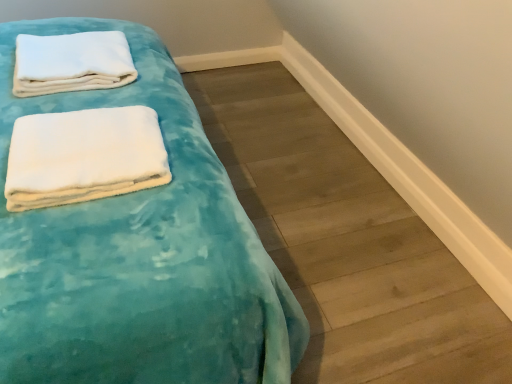
This screenshot has height=384, width=512. Find the location of `white soft towel at upper left, the second towel when ordered from back to front`. white soft towel at upper left, the second towel when ordered from back to front is located at coordinates (84, 156).

Identify the location of white soft towel at upper left, the 1th towel in the front-to-back sequence. This screenshot has width=512, height=384. (84, 156).

Based on their sizes in the image, would you say white soft towel at upper left, positioned as the first towel in bottom-to-top order, is bigger or smaller than white soft towel at upper left, positioned as the 1th towel in back-to-front order?

Clearly, white soft towel at upper left, positioned as the first towel in bottom-to-top order, is smaller in size than white soft towel at upper left, positioned as the 1th towel in back-to-front order.

Considering the positions of objects white soft towel at upper left, positioned as the first towel in bottom-to-top order, and white soft towel at upper left, placed as the 2th towel when sorted from front to back, in the image provided, who is in front, white soft towel at upper left, positioned as the first towel in bottom-to-top order, or white soft towel at upper left, placed as the 2th towel when sorted from front to back,?

white soft towel at upper left, positioned as the first towel in bottom-to-top order, is more forward.

From a real-world perspective, is white soft towel at upper left, the 1th towel in the front-to-back sequence, on white soft towel at upper left, which ranks as the first towel in top-to-bottom order?

Actually, white soft towel at upper left, the 1th towel in the front-to-back sequence, is physically below white soft towel at upper left, which ranks as the first towel in top-to-bottom order, in the real world.

Can you confirm if white soft towel at upper left, the second towel when ordered from back to front, is thinner than white soft towel at upper left, positioned as the 1th towel in back-to-front order?

Correct, the width of white soft towel at upper left, the second towel when ordered from back to front, is less than that of white soft towel at upper left, positioned as the 1th towel in back-to-front order.

Locate an element on the screen. The image size is (512, 384). plank beneath the teal velvety bed at left (from a real-world perspective) is located at coordinates (347, 242).

From the picture: Does teal velvety blanket at upper left appear on the left side of teal velvety bed at left?

Incorrect, teal velvety blanket at upper left is not on the left side of teal velvety bed at left.

Does teal velvety blanket at upper left touch teal velvety bed at left?

teal velvety blanket at upper left and teal velvety bed at left are not in contact.

Which object is further away from the camera taking this photo, teal velvety blanket at upper left or white soft towel at upper left, the 2th towel when ordered from bottom to top?

white soft towel at upper left, the 2th towel when ordered from bottom to top, is further from the camera.

Which is more to the right, teal velvety blanket at upper left or white soft towel at upper left, the 2th towel when ordered from bottom to top?

Positioned to the right is teal velvety blanket at upper left.

Is white soft towel at upper left, positioned as the 1th towel in back-to-front order, a part of teal velvety blanket at upper left?

That's incorrect, white soft towel at upper left, positioned as the 1th towel in back-to-front order, is not inside teal velvety blanket at upper left.

Considering the sizes of objects teal velvety blanket at upper left and white soft towel at upper left, the 2th towel when ordered from bottom to top, in the image provided, who is smaller, teal velvety blanket at upper left or white soft towel at upper left, the 2th towel when ordered from bottom to top,?

white soft towel at upper left, the 2th towel when ordered from bottom to top, is smaller.

Is teal velvety bed at left next to white soft towel at upper left, which ranks as the first towel in top-to-bottom order, and touching it?

No, teal velvety bed at left is not touching white soft towel at upper left, which ranks as the first towel in top-to-bottom order.

Can you confirm if teal velvety bed at left is smaller than white soft towel at upper left, the 2th towel when ordered from bottom to top?

Incorrect, teal velvety bed at left is not smaller in size than white soft towel at upper left, the 2th towel when ordered from bottom to top.

From the image's perspective, which is above, teal velvety bed at left or white soft towel at upper left, positioned as the 1th towel in back-to-front order?

white soft towel at upper left, positioned as the 1th towel in back-to-front order.

Can you confirm if teal velvety bed at left is wider than white soft towel at upper left, placed as the 2th towel when sorted from front to back?

Yes, teal velvety bed at left is wider than white soft towel at upper left, placed as the 2th towel when sorted from front to back.

In the scene shown: Does white soft towel at upper left, the 2th towel when ordered from bottom to top, appear on the left side of teal velvety blanket at upper left?

Indeed, white soft towel at upper left, the 2th towel when ordered from bottom to top, is positioned on the left side of teal velvety blanket at upper left.

From a real-world perspective, who is located higher, white soft towel at upper left, which ranks as the first towel in top-to-bottom order, or teal velvety blanket at upper left?

white soft towel at upper left, which ranks as the first towel in top-to-bottom order.

Which of these two, white soft towel at upper left, placed as the 2th towel when sorted from front to back, or teal velvety blanket at upper left, is bigger?

Bigger between the two is teal velvety blanket at upper left.

Would you consider white soft towel at upper left, positioned as the 1th towel in back-to-front order, to be distant from teal velvety blanket at upper left?

No, white soft towel at upper left, positioned as the 1th towel in back-to-front order, is in close proximity to teal velvety blanket at upper left.

Does point (92, 71) come behind point (115, 280)?

Yes, it is.

How many degrees apart are the facing directions of white soft towel at upper left, the 2th towel when ordered from bottom to top, and teal velvety bed at left?

There is a 0.968-degree angle between the facing directions of white soft towel at upper left, the 2th towel when ordered from bottom to top, and teal velvety bed at left.

Between white soft towel at upper left, the 2th towel when ordered from bottom to top, and teal velvety bed at left, which one is positioned in front?

Positioned in front is teal velvety bed at left.

Is white soft towel at upper left, placed as the 2th towel when sorted from front to back, facing away from teal velvety bed at left?

Yes, teal velvety bed at left is at the back of white soft towel at upper left, placed as the 2th towel when sorted from front to back.

Are white soft towel at upper left, the 1th towel in the front-to-back sequence, and teal velvety bed at left making contact?

white soft towel at upper left, the 1th towel in the front-to-back sequence, is not next to teal velvety bed at left, and they're not touching.

In order to click on the 2nd towel directly beneath the teal velvety bed at left (from a real-world perspective) in this screenshot , I will do pyautogui.click(x=84, y=156).

At what (x,y) coordinates should I click in order to perform the action: click on towel below the white soft towel at upper left, placed as the 2th towel when sorted from front to back (from the image's perspective). Please return your answer as a coordinate pair (x, y). The width and height of the screenshot is (512, 384). Looking at the image, I should click on (84, 156).

Where is `bed that appears above the teal velvety blanket at upper left (from a real-world perspective)`? bed that appears above the teal velvety blanket at upper left (from a real-world perspective) is located at coordinates (139, 254).

Looking at the image, which one is located closer to white soft towel at upper left, the 2th towel when ordered from bottom to top, white soft towel at upper left, the 1th towel in the front-to-back sequence, or teal velvety bed at left?

Among the two, teal velvety bed at left is located nearer to white soft towel at upper left, the 2th towel when ordered from bottom to top.

Looking at the image, which one is located further to teal velvety bed at left, teal velvety blanket at upper left or white soft towel at upper left, the 1th towel in the front-to-back sequence?

teal velvety blanket at upper left.

When comparing their distances from white soft towel at upper left, the second towel when ordered from back to front, does teal velvety bed at left or white soft towel at upper left, positioned as the 1th towel in back-to-front order, seem further?

Based on the image, white soft towel at upper left, positioned as the 1th towel in back-to-front order, appears to be further to white soft towel at upper left, the second towel when ordered from back to front.

Considering their positions, is teal velvety bed at left positioned further to teal velvety blanket at upper left than white soft towel at upper left, positioned as the first towel in bottom-to-top order?

white soft towel at upper left, positioned as the first towel in bottom-to-top order, lies further to teal velvety blanket at upper left than the other object.

From the image, which object appears to be farther from white soft towel at upper left, positioned as the 1th towel in back-to-front order, teal velvety blanket at upper left or white soft towel at upper left, positioned as the first towel in bottom-to-top order?

teal velvety blanket at upper left lies further to white soft towel at upper left, positioned as the 1th towel in back-to-front order, than the other object.

Based on their spatial positions, is white soft towel at upper left, the second towel when ordered from back to front, or teal velvety bed at left closer to teal velvety blanket at upper left?

Among the two, teal velvety bed at left is located nearer to teal velvety blanket at upper left.

When comparing their distances from white soft towel at upper left, the 1th towel in the front-to-back sequence, does white soft towel at upper left, which ranks as the first towel in top-to-bottom order, or teal velvety blanket at upper left seem further?

The object further to white soft towel at upper left, the 1th towel in the front-to-back sequence, is teal velvety blanket at upper left.

When comparing their distances from white soft towel at upper left, positioned as the first towel in bottom-to-top order, does teal velvety bed at left or teal velvety blanket at upper left seem closer?

Among the two, teal velvety bed at left is located nearer to white soft towel at upper left, positioned as the first towel in bottom-to-top order.

At what (x,y) coordinates should I click in order to perform the action: click on plank located between teal velvety bed at left and white soft towel at upper left, positioned as the 1th towel in back-to-front order, in the depth direction. Please return your answer as a coordinate pair (x, y). This screenshot has height=384, width=512. Looking at the image, I should click on (347, 242).

At what (x,y) coordinates should I click in order to perform the action: click on towel located between white soft towel at upper left, which ranks as the first towel in top-to-bottom order, and teal velvety blanket at upper left in the left-right direction. Please return your answer as a coordinate pair (x, y). Looking at the image, I should click on (84, 156).

Where is `towel positioned between teal velvety bed at left and teal velvety blanket at upper left from near to far`? towel positioned between teal velvety bed at left and teal velvety blanket at upper left from near to far is located at coordinates (84, 156).

Image resolution: width=512 pixels, height=384 pixels. In order to click on towel between teal velvety bed at left and white soft towel at upper left, which ranks as the first towel in top-to-bottom order, from front to back in this screenshot , I will do `click(84, 156)`.